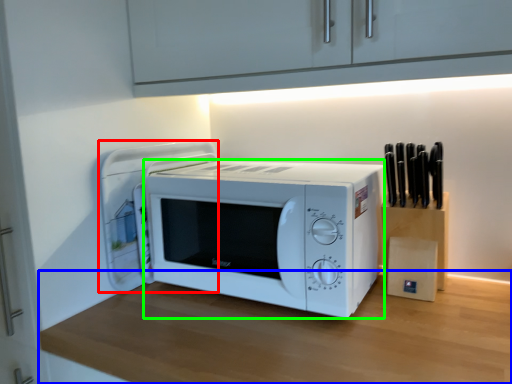
Question: Which object is positioned closest to appliance (highlighted by a red box)? Select from table (highlighted by a blue box) and microwave oven (highlighted by a green box).

Choices:
 (A) table
 (B) microwave oven

Answer: (B)